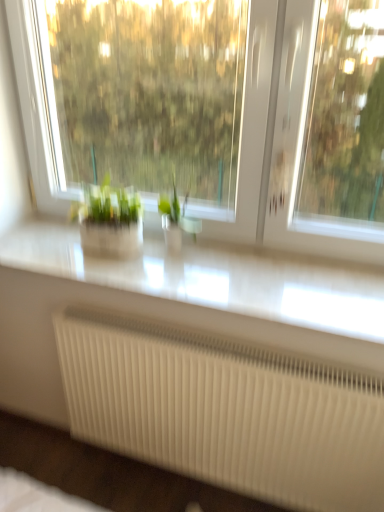
Question: From the image's perspective, is green matte plant at center positioned above or below white ribbed radiator at lower center?

Choices:
 (A) below
 (B) above

Answer: (B)

Question: From their relative heights in the image, would you say green matte plant at center is taller or shorter than white ribbed radiator at lower center?

Choices:
 (A) tall
 (B) short

Answer: (B)

Question: Which object is the farthest from the white glossy counter top at center?

Choices:
 (A) green matte plant at center
 (B) transparent glass window at center
 (C) white ribbed radiator at lower center

Answer: (B)

Question: Based on their relative distances, which object is farther from the white glossy counter top at center?

Choices:
 (A) green matte plant at center
 (B) white ribbed radiator at lower center
 (C) transparent glass window at center

Answer: (C)